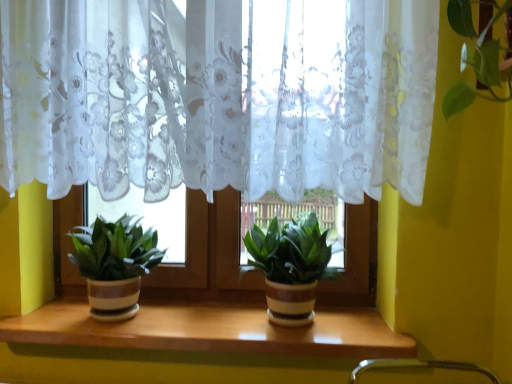
I want to click on vacant space that's between green matte plant pot at left, the first houseplant positioned from the left, and green matte plant pot at center, the first houseplant in the right-to-left sequence, so click(x=196, y=321).